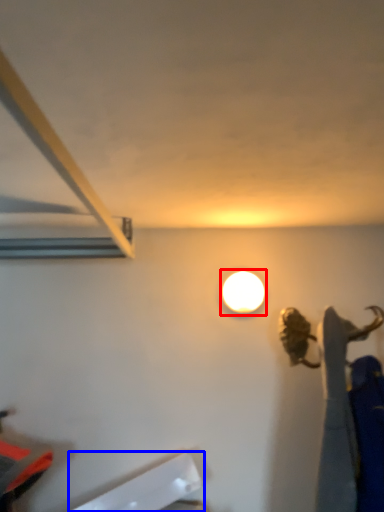
Question: Which point is further to the camera, lamp (highlighted by a red box) or wide (highlighted by a blue box)?

Choices:
 (A) lamp
 (B) wide

Answer: (A)